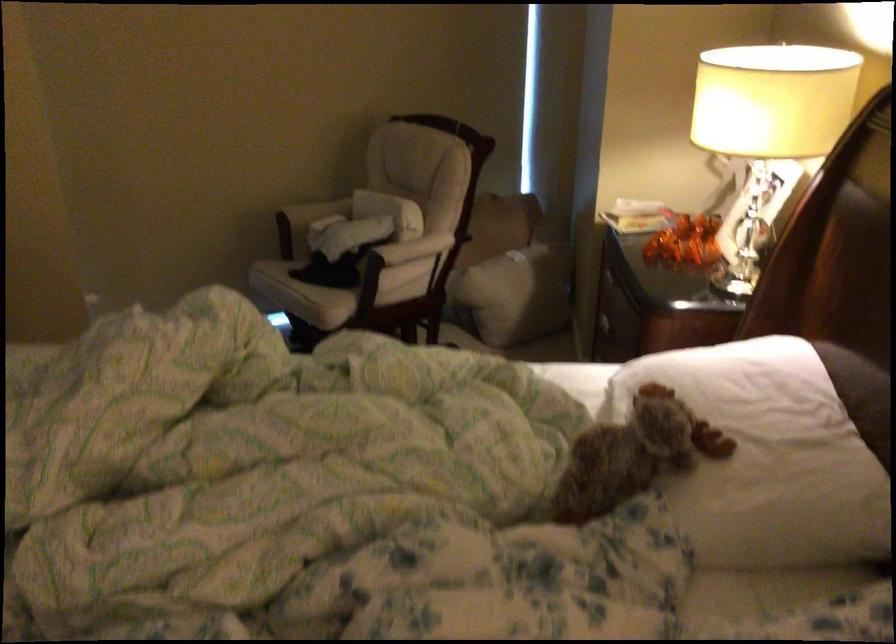
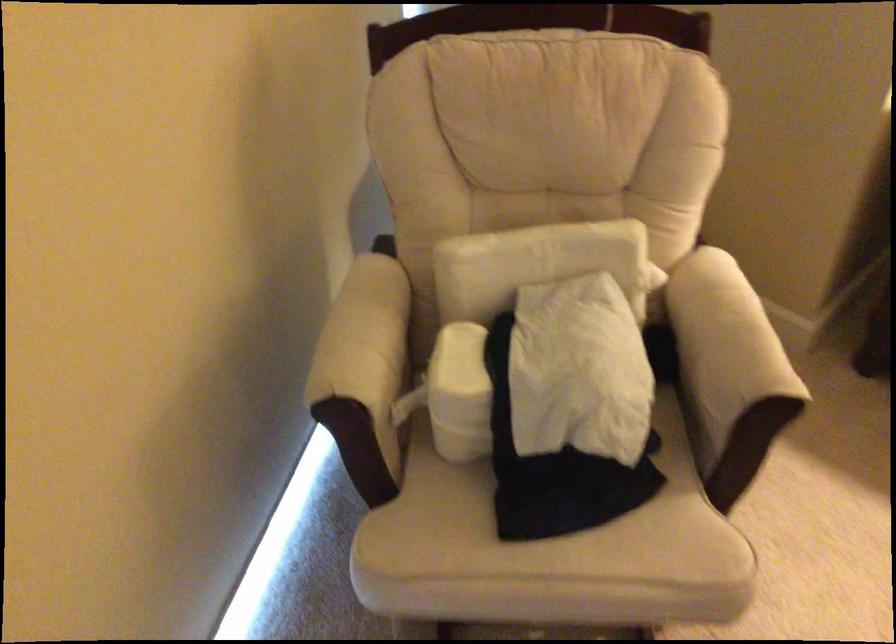
Where in the second image is the point corresponding to [391,240] from the first image?

(724, 348)